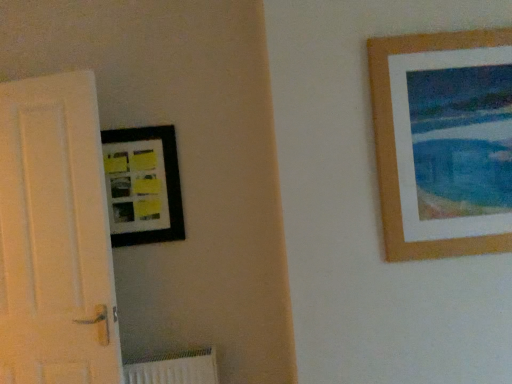
Question: Is matte black picture frame at upper left, marked as the 2th picture frame in a right-to-left arrangement, positioned in front of white matte door at left?

Choices:
 (A) no
 (B) yes

Answer: (A)

Question: Is white matte door at left completely or partially inside matte black picture frame at upper left, which is counted as the first picture frame, starting from the left?

Choices:
 (A) yes
 (B) no

Answer: (B)

Question: Is the position of matte black picture frame at upper left, the 1th picture frame positioned from the back, more distant than that of white matte door at left?

Choices:
 (A) yes
 (B) no

Answer: (A)

Question: Is matte black picture frame at upper left, the 1th picture frame positioned from the back, to the right of white matte door at left from the viewer's perspective?

Choices:
 (A) yes
 (B) no

Answer: (A)

Question: Does matte black picture frame at upper left, which is counted as the first picture frame, starting from the left, turn towards white matte door at left?

Choices:
 (A) no
 (B) yes

Answer: (A)

Question: Is wooden picture frame at upper right, arranged as the second picture frame when viewed from the back, wider or thinner than matte black picture frame at upper left, the 1th picture frame positioned from the back?

Choices:
 (A) thin
 (B) wide

Answer: (B)

Question: Is wooden picture frame at upper right, which is counted as the first picture frame, starting from the front, taller or shorter than matte black picture frame at upper left, arranged as the second picture frame when viewed from the front?

Choices:
 (A) short
 (B) tall

Answer: (B)

Question: From a real-world perspective, relative to matte black picture frame at upper left, marked as the 2th picture frame in a right-to-left arrangement, is wooden picture frame at upper right, which is counted as the first picture frame, starting from the front, vertically above or below?

Choices:
 (A) below
 (B) above

Answer: (B)

Question: Is wooden picture frame at upper right, arranged as the 2th picture frame when viewed from the left, spatially inside matte black picture frame at upper left, arranged as the second picture frame when viewed from the front, or outside of it?

Choices:
 (A) outside
 (B) inside

Answer: (A)

Question: Is white matte door at left bigger or smaller than wooden picture frame at upper right, arranged as the second picture frame when viewed from the back?

Choices:
 (A) small
 (B) big

Answer: (B)

Question: Is white matte door at left situated inside wooden picture frame at upper right, arranged as the second picture frame when viewed from the back, or outside?

Choices:
 (A) outside
 (B) inside

Answer: (A)

Question: Visually, is white matte door at left positioned to the left or to the right of wooden picture frame at upper right, the 1th picture frame from the right?

Choices:
 (A) right
 (B) left

Answer: (B)

Question: Is white matte door at left taller or shorter than wooden picture frame at upper right, arranged as the second picture frame when viewed from the back?

Choices:
 (A) short
 (B) tall

Answer: (B)

Question: Is wooden picture frame at upper right, the 1th picture frame from the right, taller or shorter than white matte door at left?

Choices:
 (A) tall
 (B) short

Answer: (B)

Question: Is wooden picture frame at upper right, arranged as the second picture frame when viewed from the back, wider or thinner than white matte door at left?

Choices:
 (A) wide
 (B) thin

Answer: (B)